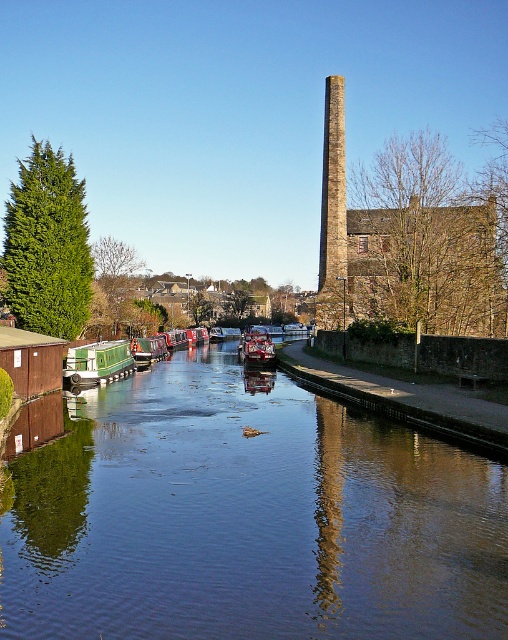
You are planning to navigate a new boat through the canal and need to know the minimum length requirement for boats passing under the bridge ahead. You observe the green painted wooden canal boat at left and the metallic red boat at center. Which boat demonstrates the minimum length requirement that can safely pass under the bridge?

The green painted wooden canal boat at left is shorter than the metallic red boat at center, so it meets the minimum length requirement and can safely pass under the bridge.

You are standing at the edge of the canal and want to determine the relative positions of two points marked in the scene. Which point, point (202, 397) or point (250, 360), is closer to you?

Point (202, 397) is closer to the viewer than point (250, 360).

You are standing on the left side of the canal and want to cross to the right side. You see the smooth dark water at center and the rustic stone chimney at center. Which object is closer to your current position?

The smooth dark water at center is closer to your current position on the left side of the canal since it is located to the left of the rustic stone chimney at center.